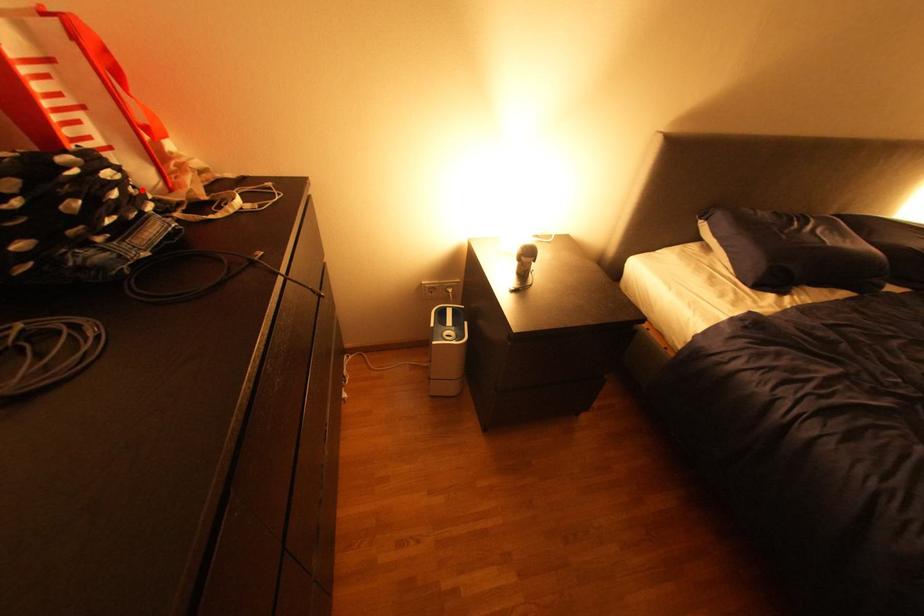
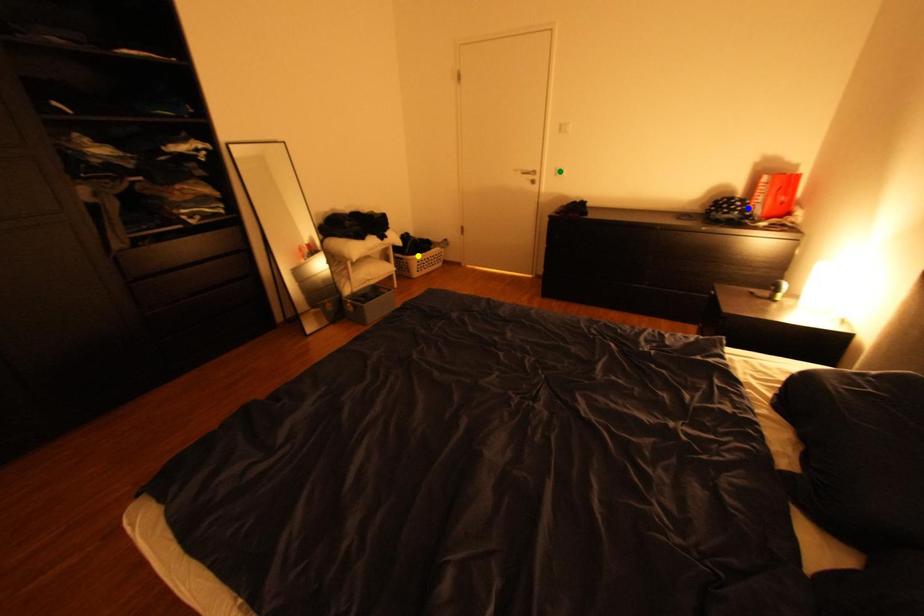
Question: I am providing you with two images of the same scene from different viewpoints. A red point is marked on the first image. You are given multiple points on the second image. Can you choose the point in image 2 that corresponds to the point in image 1?

Choices:
 (A) blue point
 (B) yellow point
 (C) green point

Answer: (A)